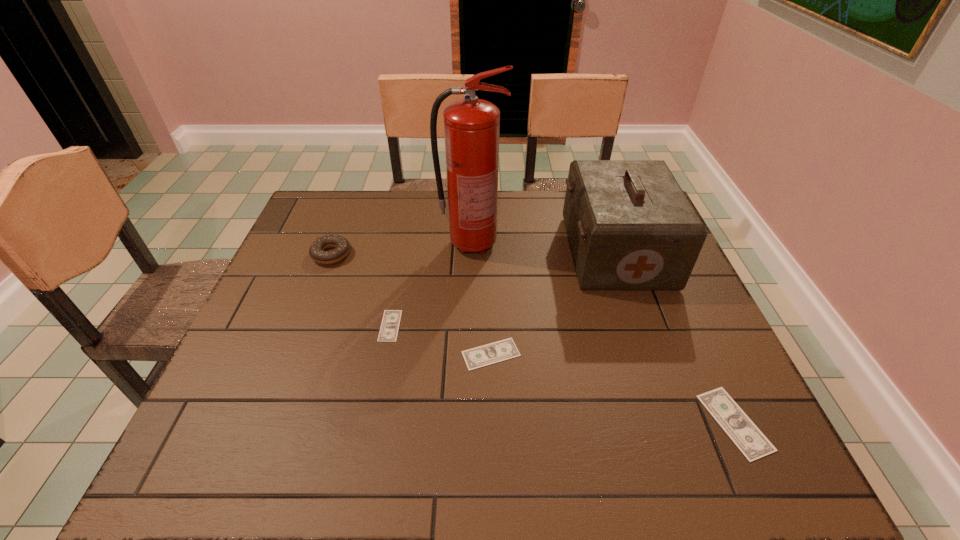
Locate which object ranks fourth in proximity to the tallest money. Please provide its 2D coordinates. Your answer should be formatted as a tuple, i.e. [(x, y)], where the tuple contains the x and y coordinates of a point satisfying the conditions above.

[(389, 328)]

Select which object appears as the fourth closest to the shortest object. Please provide its 2D coordinates. Your answer should be formatted as a tuple, i.e. [(x, y)], where the tuple contains the x and y coordinates of a point satisfying the conditions above.

[(630, 226)]

Identify which money is the closest to the first-aid kit. Please provide its 2D coordinates. Your answer should be formatted as a tuple, i.e. [(x, y)], where the tuple contains the x and y coordinates of a point satisfying the conditions above.

[(499, 351)]

Identify which money is located as the nearest to the second money from right to left. Please provide its 2D coordinates. Your answer should be formatted as a tuple, i.e. [(x, y)], where the tuple contains the x and y coordinates of a point satisfying the conditions above.

[(389, 328)]

Identify the location of free space that satisfies the following two spatial constraints: 1. on the handle side the fifth tallest object; 2. on the left side of the fire extinguisher. Image resolution: width=960 pixels, height=540 pixels. (469, 354).

I want to click on free space in the image that satisfies the following two spatial constraints: 1. on the handle side the nearest money; 2. on the right side of the tallest object, so click(x=468, y=422).

Where is `vacant position in the image that satisfies the following two spatial constraints: 1. on the front side of the shortest object; 2. on the right side of the rightmost money`? vacant position in the image that satisfies the following two spatial constraints: 1. on the front side of the shortest object; 2. on the right side of the rightmost money is located at coordinates [372, 422].

Identify the location of vacant space that satisfies the following two spatial constraints: 1. on the back side of the first-aid kit; 2. on the handle side the fire extinguisher. Image resolution: width=960 pixels, height=540 pixels. (613, 244).